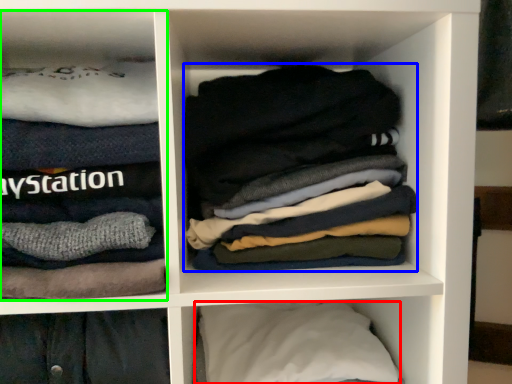
Question: Which is farther away from pillow (highlighted by a red box)? laundry (highlighted by a blue box) or cabinet (highlighted by a green box)?

Choices:
 (A) laundry
 (B) cabinet

Answer: (B)